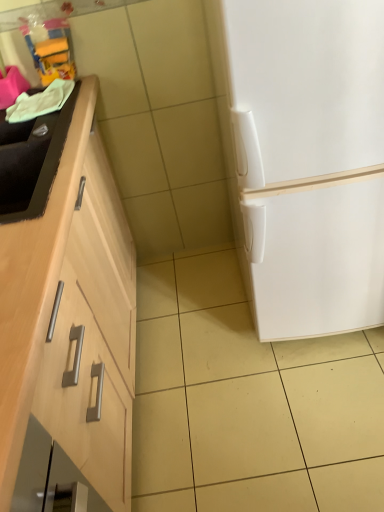
Question: Is black matte sink at left taller or shorter than white matte refrigerator at right?

Choices:
 (A) short
 (B) tall

Answer: (A)

Question: Based on their sizes in the image, would you say black matte sink at left is bigger or smaller than white matte refrigerator at right?

Choices:
 (A) big
 (B) small

Answer: (B)

Question: Is black matte sink at left spatially inside white matte refrigerator at right, or outside of it?

Choices:
 (A) outside
 (B) inside

Answer: (A)

Question: Considering the relative positions of white matte refrigerator at right and black matte sink at left in the image provided, is white matte refrigerator at right to the left or to the right of black matte sink at left?

Choices:
 (A) left
 (B) right

Answer: (B)

Question: From a real-world perspective, is white matte refrigerator at right above or below black matte sink at left?

Choices:
 (A) above
 (B) below

Answer: (B)

Question: Considering the positions of point (228, 88) and point (1, 170), is point (228, 88) closer or farther from the camera than point (1, 170)?

Choices:
 (A) closer
 (B) farther

Answer: (A)

Question: Is white matte refrigerator at right taller or shorter than black matte sink at left?

Choices:
 (A) tall
 (B) short

Answer: (A)